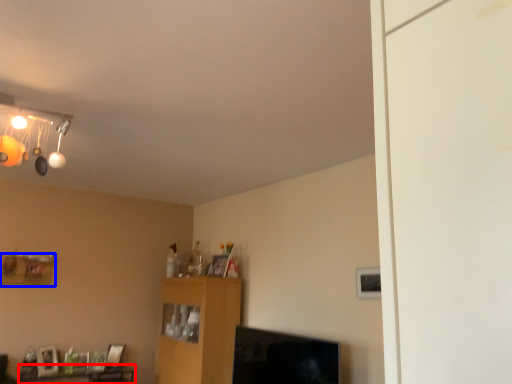
Question: Which object is further to the camera taking this photo, table (highlighted by a red box) or shelf (highlighted by a blue box)?

Choices:
 (A) table
 (B) shelf

Answer: (B)